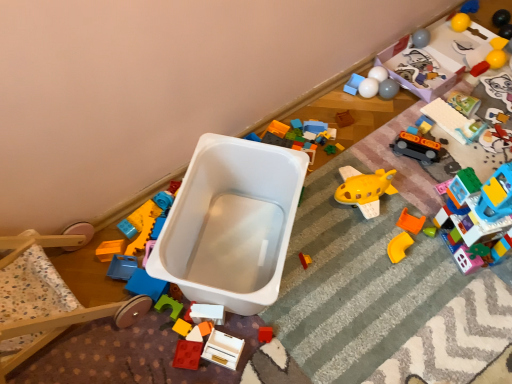
At what (x,y) coordinates should I click in order to perform the action: click on vacant space in between rubberized red brick at lower center, positioned as the fifteenth toy in right-to-left order, and orange plastic block at lower right, the 7th toy when ordered from right to left. Please return your answer as a coordinate pair (x, y). Looking at the image, I should click on (314, 281).